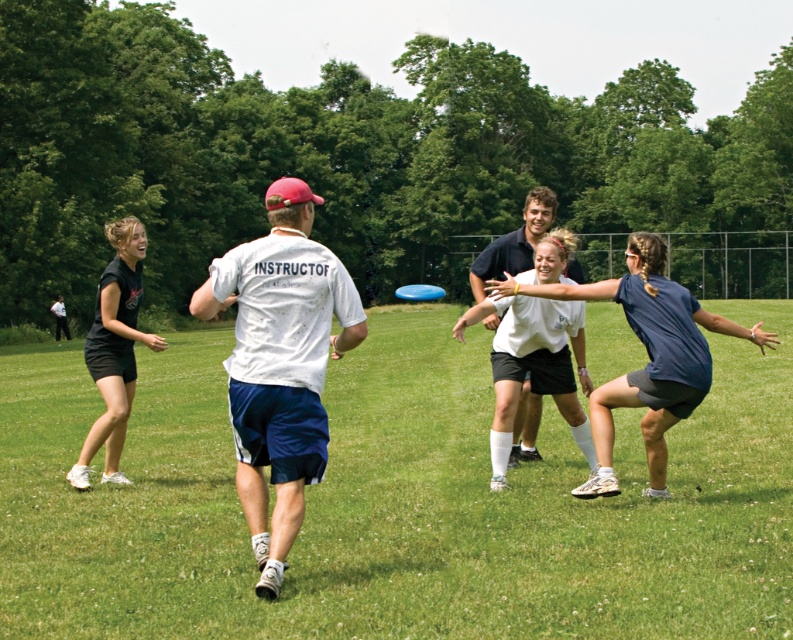
Question: Does green grass at center lie in front of white matte shirt at center?

Choices:
 (A) no
 (B) yes

Answer: (B)

Question: Observing the image, what is the correct spatial positioning of green grass at center in reference to dark blue jersey at center?

Choices:
 (A) below
 (B) above

Answer: (A)

Question: Which object is positioned closest to the black matte shorts at left?

Choices:
 (A) white smooth shirt at center
 (B) white matte shirt at center

Answer: (B)

Question: Which point appears farthest from the camera in this image?

Choices:
 (A) (397, 294)
 (B) (276, 237)
 (C) (730, 518)

Answer: (A)

Question: Which object is positioned closest to the green grass at center?

Choices:
 (A) dark blue jersey at center
 (B) white smooth shirt at center

Answer: (A)

Question: Is white matte shirt at center smaller than black matte shorts at left?

Choices:
 (A) no
 (B) yes

Answer: (B)